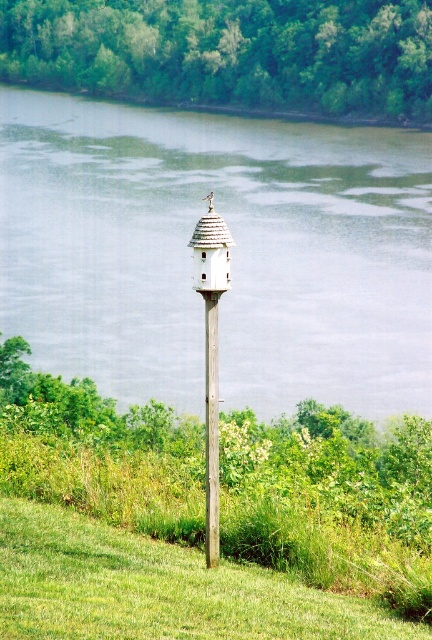
Can you confirm if green water at center is bigger than green grassy hillside at center?

Yes, green water at center is bigger than green grassy hillside at center.

Is point (105, 138) positioned before point (205, 58)?

Yes, point (105, 138) is closer to viewer.

Find the location of a particular element. The image size is (432, 640). green water at center is located at coordinates (231, 253).

Who is higher up, green water at center or white wood pole at center?

Positioned higher is green water at center.

Does green water at center appear on the left side of white wood pole at center?

Incorrect, green water at center is not on the left side of white wood pole at center.

Does point (83, 253) lie in front of point (206, 429)?

That is False.

In order to click on green water at center in this screenshot , I will do `click(231, 253)`.

Can you confirm if green grass at center is taller than white wood pole at center?

In fact, green grass at center may be shorter than white wood pole at center.

Between green grass at center and white wood pole at center, which one appears on the left side from the viewer's perspective?

From the viewer's perspective, green grass at center appears more on the left side.

Where is `green grass at center`? green grass at center is located at coordinates [158, 589].